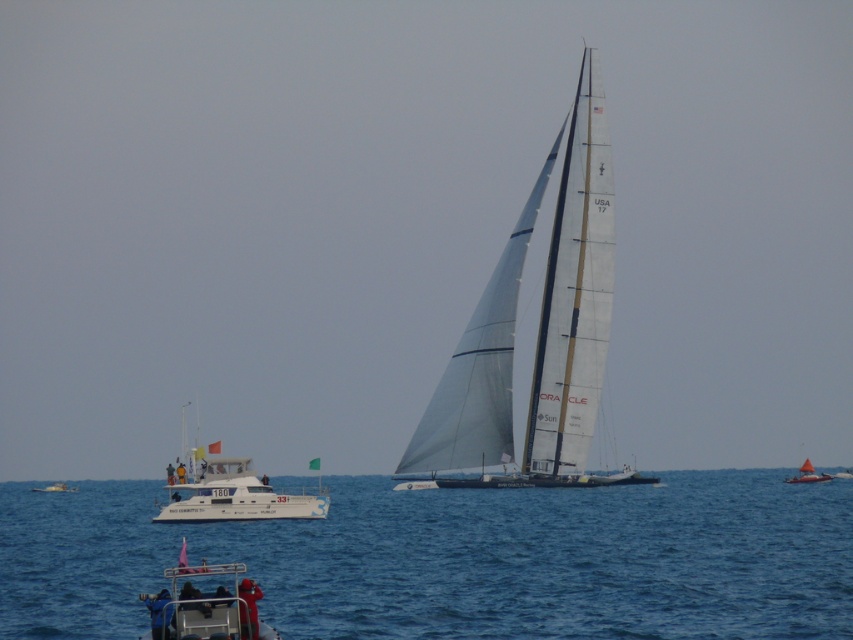
Is point (175, 518) farther from viewer compared to point (223, 624)?

That is True.

Between white matte yacht at lower left and metallic gray boat at lower left, which one appears on the left side from the viewer's perspective?

From the viewer's perspective, white matte yacht at lower left appears more on the left side.

Locate an element on the screen. white matte yacht at lower left is located at coordinates (231, 492).

Find the location of `white matte yacht at lower left`. white matte yacht at lower left is located at coordinates (x=231, y=492).

Is white matte sailboat at center bigger than bright orange sailboat at right?

Yes.

Is white matte sailboat at center smaller than bright orange sailboat at right?

Actually, white matte sailboat at center might be larger than bright orange sailboat at right.

What do you see at coordinates (538, 330) in the screenshot? The height and width of the screenshot is (640, 853). I see `white matte sailboat at center` at bounding box center [538, 330].

Identify the location of white matte sailboat at center. (538, 330).

Is white matte yacht at lower left taller than white plastic boat at lower left?

Yes.

Is white matte yacht at lower left bigger than white plastic boat at lower left?

Yes.

Is point (171, 493) less distant than point (67, 488)?

Yes, it is.

Where is `white matte yacht at lower left`? white matte yacht at lower left is located at coordinates (231, 492).